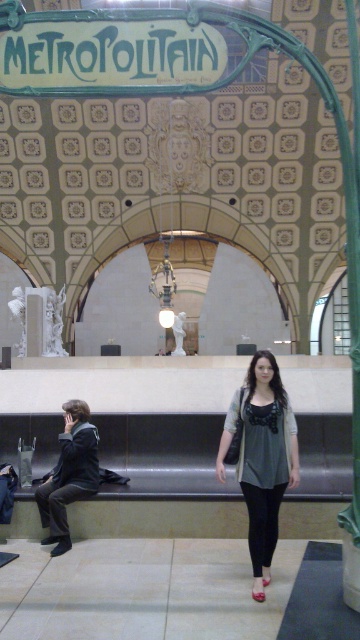
Does matte gray blouse at center have a lesser width compared to dark gray fabric jacket at left?

No, matte gray blouse at center is not thinner than dark gray fabric jacket at left.

Image resolution: width=360 pixels, height=640 pixels. In order to click on matte gray blouse at center in this screenshot , I will do `click(262, 458)`.

The image size is (360, 640). I want to click on matte gray blouse at center, so click(x=262, y=458).

Identify the location of matte gray blouse at center. The width and height of the screenshot is (360, 640). (262, 458).